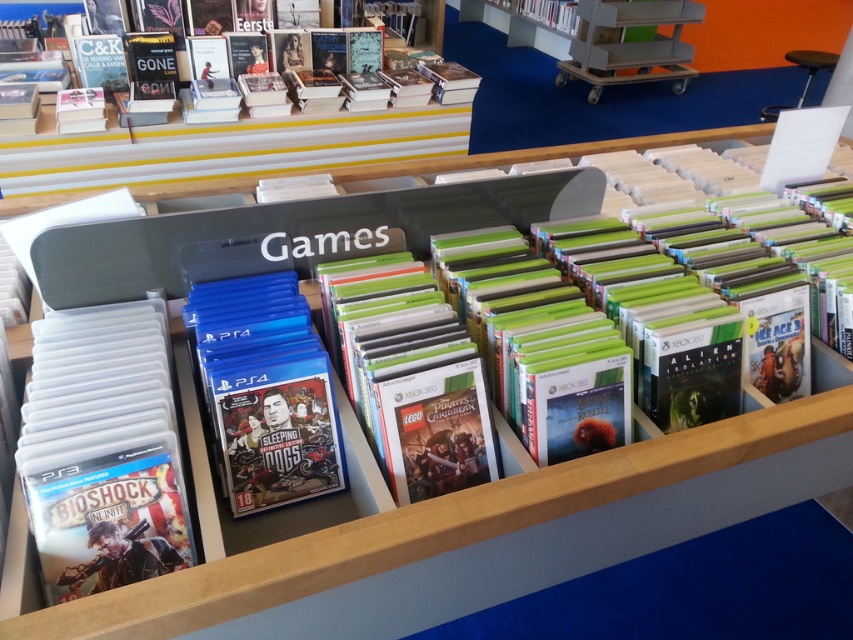
Between clear plastic case at left and blue plastic game case at center, which one is positioned lower?

clear plastic case at left

The image size is (853, 640). What do you see at coordinates (103, 451) in the screenshot?
I see `clear plastic case at left` at bounding box center [103, 451].

Between point (96, 381) and point (223, 452), which one is positioned in front?

Point (96, 381) is in front.

Where is `clear plastic case at left`? This screenshot has width=853, height=640. clear plastic case at left is located at coordinates (103, 451).

Is blue plastic game case at center behind hardcover book at upper center?

No, it is in front of hardcover book at upper center.

The width and height of the screenshot is (853, 640). What do you see at coordinates (265, 394) in the screenshot? I see `blue plastic game case at center` at bounding box center [265, 394].

What are the coordinates of `blue plastic game case at center` in the screenshot? It's located at (265, 394).

Does clear plastic case at left appear on the right side of hardcover book at upper center?

A: Incorrect, clear plastic case at left is not on the right side of hardcover book at upper center.

Is clear plastic case at left wider than hardcover book at upper center?

Yes.

At what (x,y) coordinates should I click in order to perform the action: click on clear plastic case at left. Please return your answer as a coordinate pair (x, y). Looking at the image, I should click on (103, 451).